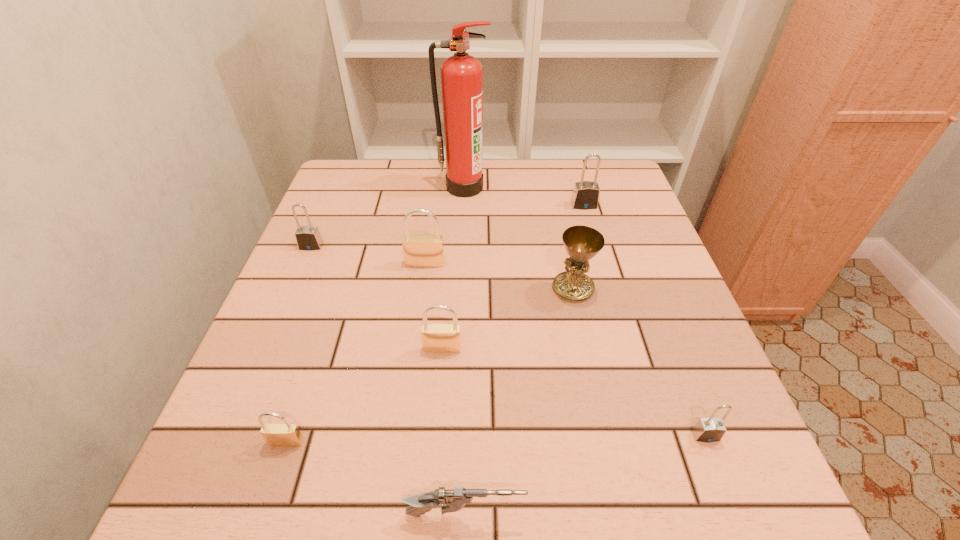
I want to click on free space located on the shackle of the seventh nearest object, so pyautogui.click(x=251, y=389).

Identify the location of free point located 0.170m on the front-facing side of the second nearest brass padlock. The width and height of the screenshot is (960, 540). (436, 441).

Where is `free space located on the shackle of the rightmost padlock`? The width and height of the screenshot is (960, 540). free space located on the shackle of the rightmost padlock is located at coordinates (734, 511).

Find the location of a particular element. This screenshot has height=540, width=960. free region located on the front-facing side of the second object from left to right is located at coordinates 270,494.

The height and width of the screenshot is (540, 960). What are the coordinates of `vacant region located 0.350m at the barrel of the nearest object` in the screenshot? It's located at (772, 515).

Find the location of a particular element. Image resolution: width=960 pixels, height=540 pixels. fire extinguisher present at the far edge is located at coordinates (461, 74).

Locate an element on the screen. padlock that is at the far edge is located at coordinates (585, 196).

Identify the location of object at the near edge. The image size is (960, 540). tap(450, 500).

Locate an element on the screen. The height and width of the screenshot is (540, 960). object that is positioned at the far right corner is located at coordinates (585, 196).

The height and width of the screenshot is (540, 960). In order to click on vacant area at the far edge of the desktop in this screenshot , I will do `click(553, 185)`.